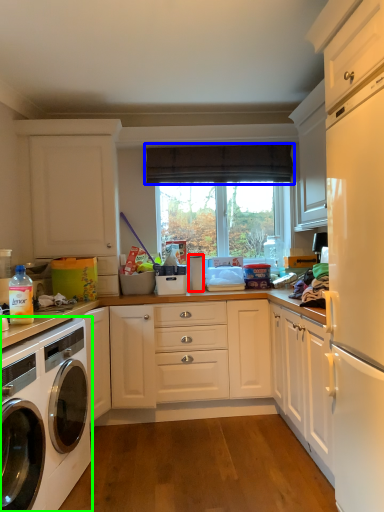
Question: Which object is positioned farthest from appliance (highlighted by a red box)? Select from curtain (highlighted by a blue box) and washing machine (highlighted by a green box).

Choices:
 (A) curtain
 (B) washing machine

Answer: (B)